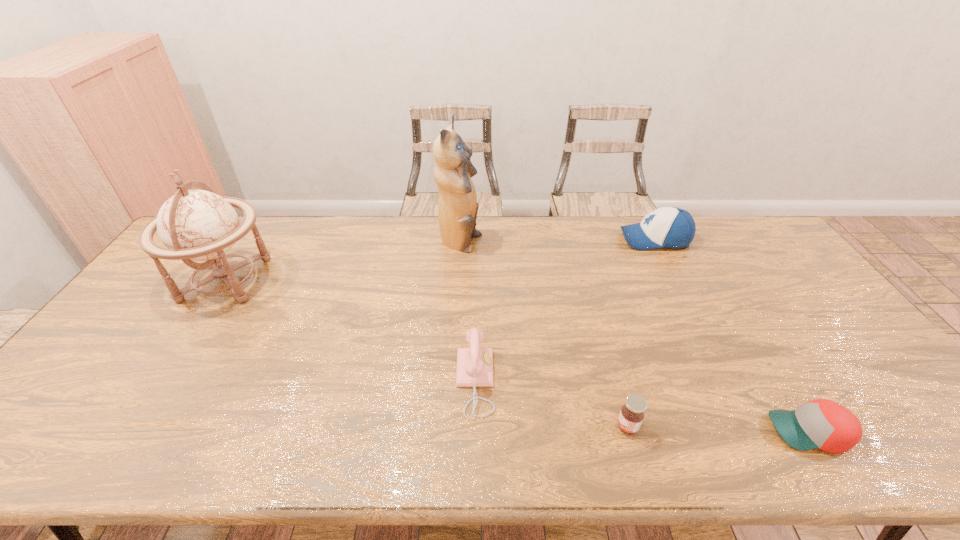
Image resolution: width=960 pixels, height=540 pixels. Find the location of `cat`. cat is located at coordinates (457, 207).

Locate an element on the screen. the fifth shortest object is located at coordinates (199, 225).

Where is `the leftmost object`? The image size is (960, 540). the leftmost object is located at coordinates (199, 225).

Where is `the taller baseball cap`? the taller baseball cap is located at coordinates (670, 227).

I want to click on telephone, so click(474, 365).

This screenshot has width=960, height=540. Find the location of `jam`. jam is located at coordinates pyautogui.click(x=631, y=415).

Where is `the fourth object from left to right`? This screenshot has height=540, width=960. the fourth object from left to right is located at coordinates (631, 415).

Locate an element on the screen. the shortest object is located at coordinates (822, 424).

You are a GUI agent. You are given a task and a screenshot of the screen. Output one action in this format:
    pyautogui.click(x=<x>, y=<y>)
    Task: Click on the nearer baseball cap
    Image resolution: width=960 pixels, height=540 pixels.
    Given the screenshot: What is the action you would take?
    pyautogui.click(x=822, y=424)

The width and height of the screenshot is (960, 540). Identify the location of free space located on the face of the cat. click(560, 244).